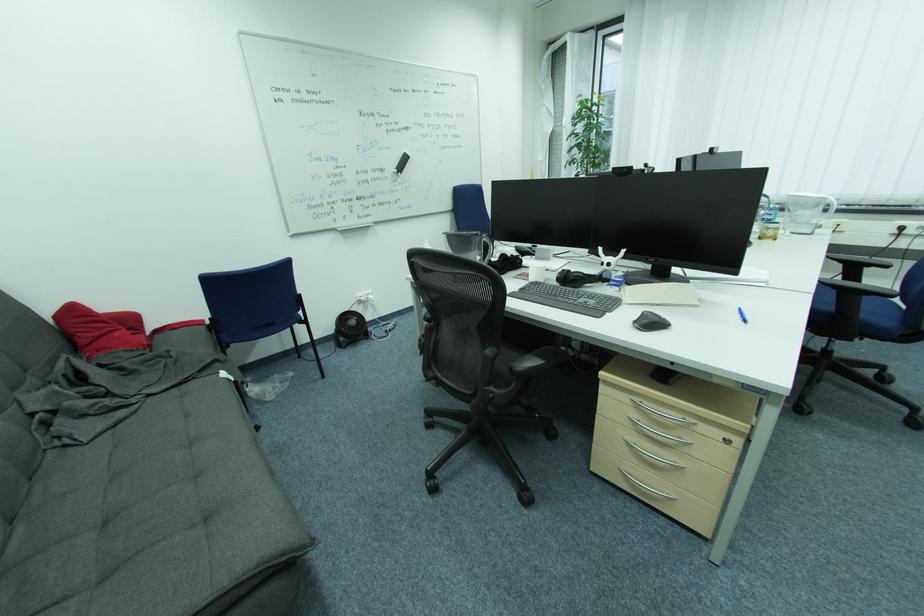
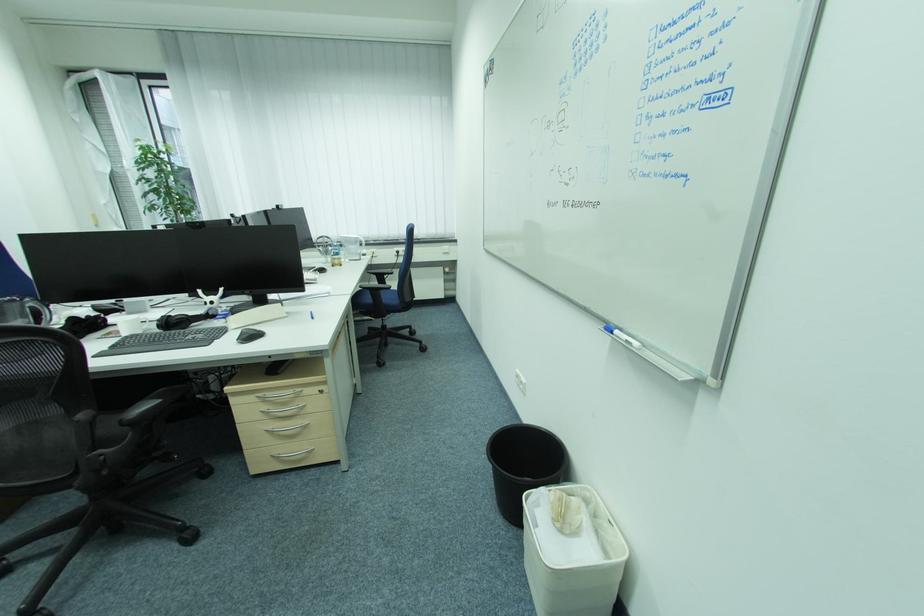
Find the pixel in the second image that matches pixel 627 469 in the first image.

(278, 455)